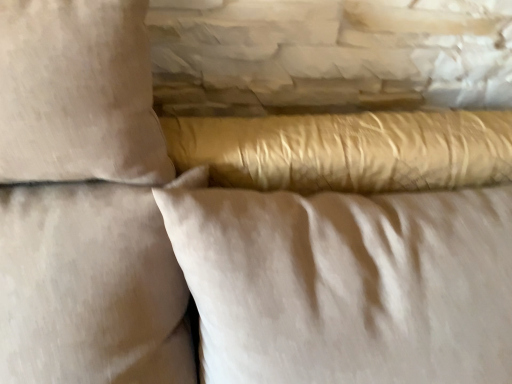
Question: Visually, is beige fabric pillow at upper left, which is counted as the 3th pillow, starting from the right, positioned to the left or to the right of satin gold pillow at center, the first pillow in the right-to-left sequence?

Choices:
 (A) left
 (B) right

Answer: (A)

Question: Considering their positions, is beige fabric pillow at upper left, which is counted as the 3th pillow, starting from the right, located in front of or behind satin gold pillow at center, the first pillow in the right-to-left sequence?

Choices:
 (A) front
 (B) behind

Answer: (A)

Question: Based on their relative distances, which object is farther from the satin gold pillow at center, which ranks as the 3th pillow in left-to-right order?

Choices:
 (A) beige cotton pillow at upper left, acting as the second pillow starting from the left
 (B) beige fabric pillow at upper left, which is counted as the 3th pillow, starting from the right

Answer: (A)

Question: Which is nearer to the beige fabric pillow at upper left, marked as the first pillow in a left-to-right arrangement?

Choices:
 (A) beige cotton pillow at upper left, acting as the second pillow starting from the left
 (B) satin gold pillow at center, the first pillow in the right-to-left sequence

Answer: (A)